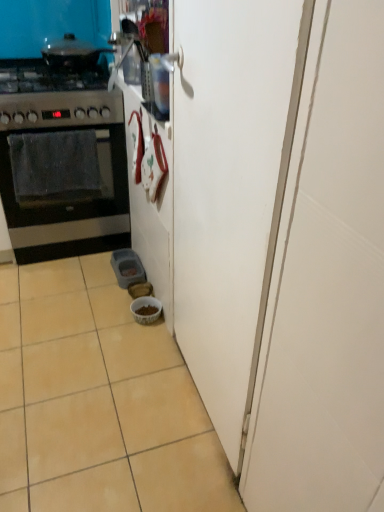
Locate an element on the screen. vacant space to the left of white glossy bowl at lower center is located at coordinates (109, 314).